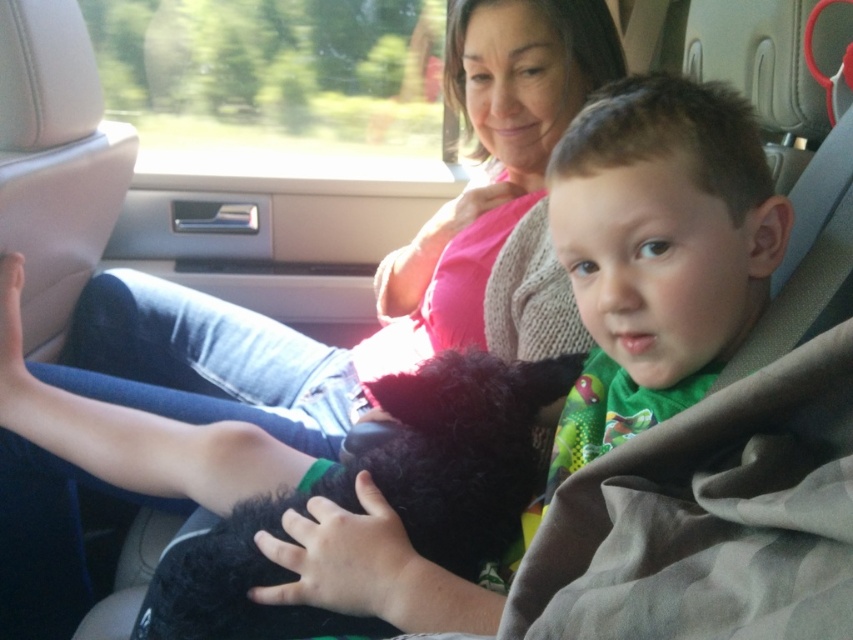
You are a passenger in the car and want to take a photo of the green jersey at center and the black fuzzy dog at center. Which object is wider when viewed from your seat?

The black fuzzy dog at center is wider than the green jersey at center because the green jersey at center has a smaller width.

You are a photographer trying to capture a closeup of both the green jersey at center and the black fuzzy dog at center in the car. Given that your camera can only focus on objects within a 8 inch range, will you be able to get both in focus?

The green jersey at center and black fuzzy dog at center are 7.96 inches apart, so yes, the camera can focus on both since the distance between them is within the 8 inch range.

You are a passenger in the car and need to locate the green jersey at center. According to the coordinates provided, where should you look to find it?

The green jersey at center is located at point [659,250].